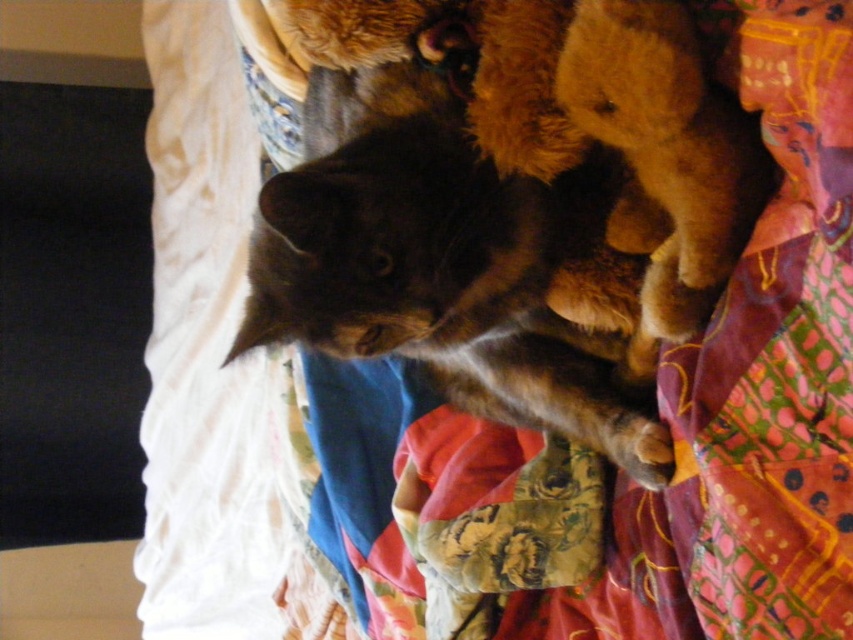
Between dark brown fur cat at center and soft brown teddy bear at upper right, which one is positioned lower?

dark brown fur cat at center is lower down.

Does dark brown fur cat at center appear over soft brown teddy bear at upper right?

No.

Between point (372, 244) and point (619, 97), which one is positioned behind?

The point (372, 244) is more distant.

The image size is (853, 640). Find the location of `dark brown fur cat at center`. dark brown fur cat at center is located at coordinates (434, 280).